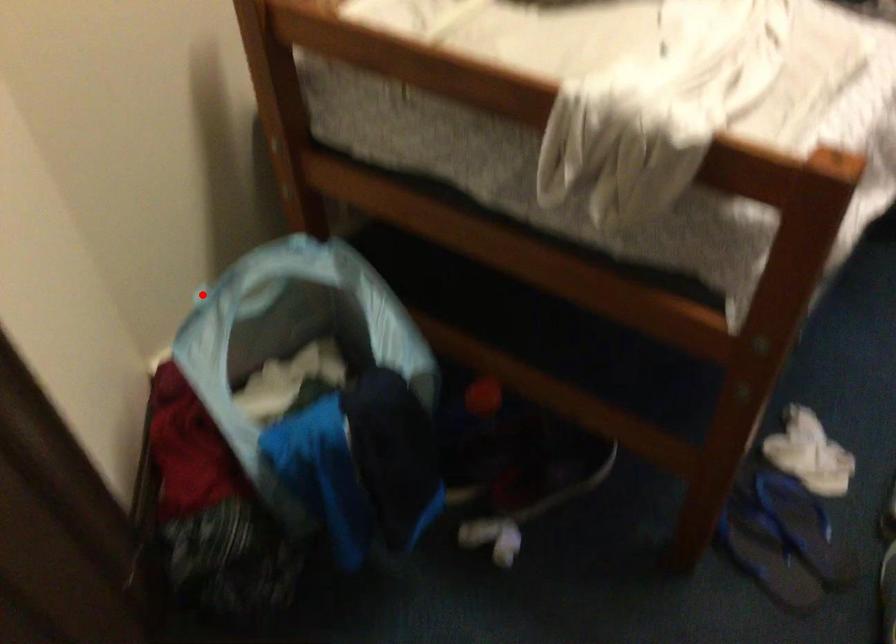
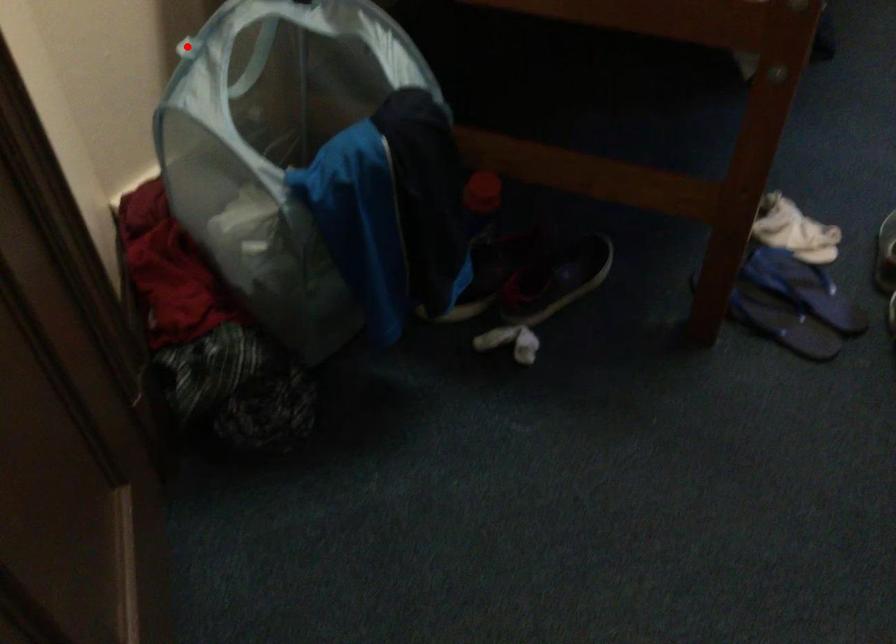
I am providing you with two images of the same scene from different viewpoints. A red point is marked on the first image and another point is marked on the second image. Is the marked point in image1 the same physical position as the marked point in image2?

Yes